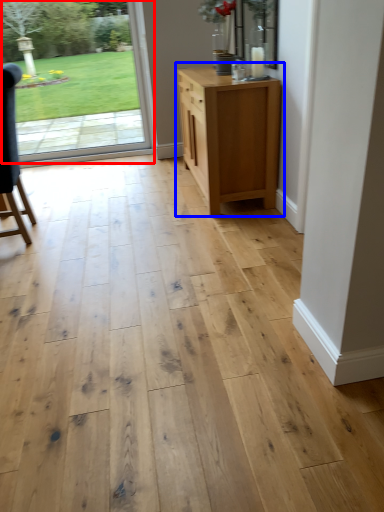
Question: Which object appears closest to the camera in this image, door (highlighted by a red box) or chest of drawers (highlighted by a blue box)?

Choices:
 (A) door
 (B) chest of drawers

Answer: (B)